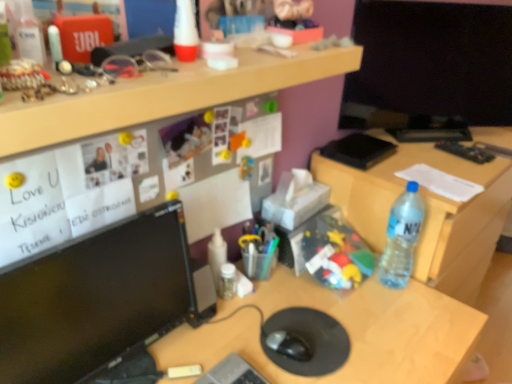
Where is `free space in front of translucent plastic bottle at center, which is the 2th bottle from right to left`? The width and height of the screenshot is (512, 384). free space in front of translucent plastic bottle at center, which is the 2th bottle from right to left is located at coordinates (221, 328).